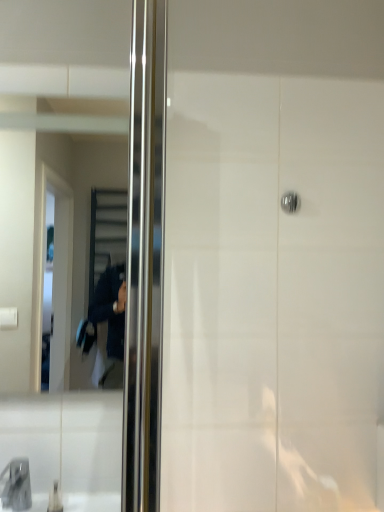
Question: From a real-world perspective, is metallic reflective mirror at left positioned above or below satin chrome door handle at upper center?

Choices:
 (A) above
 (B) below

Answer: (B)

Question: Visually, is metallic reflective mirror at left positioned to the left or to the right of satin chrome door handle at upper center?

Choices:
 (A) left
 (B) right

Answer: (A)

Question: Estimate the real-world distances between objects in this image. Which object is farther from the metallic reflective mirror at left?

Choices:
 (A) satin chrome door handle at upper center
 (B) matte gray faucet at lower left

Answer: (A)

Question: Which object is positioned closest to the metallic reflective mirror at left?

Choices:
 (A) satin chrome door handle at upper center
 (B) matte gray faucet at lower left

Answer: (B)